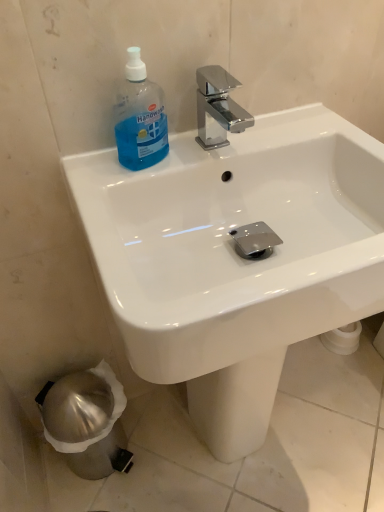
I want to click on blue translucent plastic handwash at upper left, so 140,117.

This screenshot has width=384, height=512. What do you see at coordinates (140, 117) in the screenshot? I see `blue translucent plastic handwash at upper left` at bounding box center [140, 117].

What is the approximate width of white glossy sink at center?

It is 17.06 inches.

What do you see at coordinates (236, 253) in the screenshot? I see `white glossy sink at center` at bounding box center [236, 253].

Measure the distance between white glossy sink at center and camera.

The distance of white glossy sink at center from camera is 18.37 inches.

The width and height of the screenshot is (384, 512). I want to click on white glossy sink at center, so [236, 253].

This screenshot has height=512, width=384. What are the coordinates of `blue translucent plastic handwash at upper left` in the screenshot? It's located at (140, 117).

Considering the relative positions of blue translucent plastic handwash at upper left and white glossy sink at center in the image provided, is blue translucent plastic handwash at upper left to the left of white glossy sink at center from the viewer's perspective?

Yes, blue translucent plastic handwash at upper left is to the left of white glossy sink at center.

Which object is closer to the camera taking this photo, blue translucent plastic handwash at upper left or white glossy sink at center?

Positioned in front is white glossy sink at center.

Does point (126, 154) come closer to viewer compared to point (214, 436)?

Yes, it is in front of point (214, 436).

From the image's perspective, between blue translucent plastic handwash at upper left and white glossy sink at center, which one is located above?

blue translucent plastic handwash at upper left is shown above in the image.

From a real-world perspective, which object stands above the other?

In real-world perspective, blue translucent plastic handwash at upper left is above.

Between blue translucent plastic handwash at upper left and white glossy sink at center, which one has larger width?

Wider between the two is white glossy sink at center.

Does blue translucent plastic handwash at upper left have a lesser height compared to white glossy sink at center?

Correct, blue translucent plastic handwash at upper left is not as tall as white glossy sink at center.

Between blue translucent plastic handwash at upper left and white glossy sink at center, which one has larger size?

Bigger between the two is white glossy sink at center.

Is blue translucent plastic handwash at upper left positioned beyond the bounds of white glossy sink at center?

No, blue translucent plastic handwash at upper left is inside white glossy sink at center's boundary.

Is blue translucent plastic handwash at upper left next to white glossy sink at center and touching it?

blue translucent plastic handwash at upper left and white glossy sink at center are clearly separated.

Is blue translucent plastic handwash at upper left facing away from white glossy sink at center?

Yes, blue translucent plastic handwash at upper left's orientation is away from white glossy sink at center.

How many degrees apart are the facing directions of blue translucent plastic handwash at upper left and white glossy sink at center?

The angle between the facing direction of blue translucent plastic handwash at upper left and the facing direction of white glossy sink at center is 1.21 degrees.

How far apart are blue translucent plastic handwash at upper left and white glossy sink at center?

blue translucent plastic handwash at upper left is 7.95 inches away from white glossy sink at center.

Find the location of `sink that appears below the blue translucent plastic handwash at upper left (from the image's perspective)`. sink that appears below the blue translucent plastic handwash at upper left (from the image's perspective) is located at coordinates (236, 253).

In the scene shown: Does white glossy sink at center appear on the left side of blue translucent plastic handwash at upper left?

Incorrect, white glossy sink at center is not on the left side of blue translucent plastic handwash at upper left.

Is white glossy sink at center closer to camera compared to blue translucent plastic handwash at upper left?

Yes, the depth of white glossy sink at center is less than that of blue translucent plastic handwash at upper left.

Which is in front, point (273, 254) or point (145, 133)?

Positioned in front is point (145, 133).

From the image's perspective, is white glossy sink at center over blue translucent plastic handwash at upper left?

No, from the image's perspective, white glossy sink at center is not over blue translucent plastic handwash at upper left.

From a real-world perspective, between white glossy sink at center and blue translucent plastic handwash at upper left, who is vertically lower?

In real-world perspective, white glossy sink at center is lower.

Between white glossy sink at center and blue translucent plastic handwash at upper left, which one has smaller width?

Thinner between the two is blue translucent plastic handwash at upper left.

From their relative heights in the image, would you say white glossy sink at center is taller or shorter than blue translucent plastic handwash at upper left?

Considering their sizes, white glossy sink at center has more height than blue translucent plastic handwash at upper left.

Which of these two, white glossy sink at center or blue translucent plastic handwash at upper left, is bigger?

Bigger between the two is white glossy sink at center.

Which is correct: white glossy sink at center is inside blue translucent plastic handwash at upper left, or outside of it?

white glossy sink at center is spatially situated outside blue translucent plastic handwash at upper left.

Is white glossy sink at center not close to blue translucent plastic handwash at upper left?

white glossy sink at center is near blue translucent plastic handwash at upper left, not far away.

Is white glossy sink at center aimed at blue translucent plastic handwash at upper left?

No, white glossy sink at center is not turned towards blue translucent plastic handwash at upper left.

Can you tell me how much white glossy sink at center and blue translucent plastic handwash at upper left differ in facing direction?

The angle between the facing direction of white glossy sink at center and the facing direction of blue translucent plastic handwash at upper left is 1.21 degrees.

In order to click on cleaning product behind the white glossy sink at center in this screenshot , I will do `click(140, 117)`.

You are a GUI agent. You are given a task and a screenshot of the screen. Output one action in this format:
    pyautogui.click(x=<x>, y=<y>)
    Task: Click on the sink in front of the blue translucent plastic handwash at upper left
    The image size is (384, 512).
    Given the screenshot: What is the action you would take?
    pyautogui.click(x=236, y=253)

Image resolution: width=384 pixels, height=512 pixels. What are the coordinates of `sink beneath the blue translucent plastic handwash at upper left (from a real-world perspective)` in the screenshot? It's located at (236, 253).